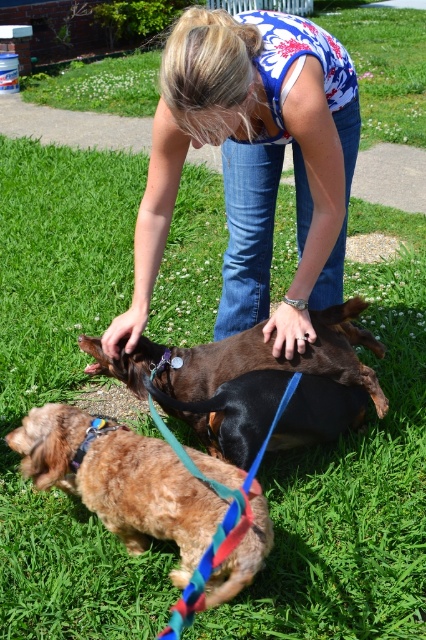
You are a photographer standing 5 feet away from the camera. You want to take a photo of the blue floral tank top at center. Can you reach it without moving closer?

The blue floral tank top at center is 6.04 feet away from the camera. Since you are already 5 feet away from the camera, you need to move 1.04 feet closer to reach it.

Based on the provided scene description, can you identify the object located at the coordinates point (253, 163)?

The point (253, 163) indicates the blue floral tank top at center.

You are a photographer trying to capture the scene of the woman and the dogs. You want to ensure that both the brown glossy dog at center and the shiny brown fur at lower left are visible in your photo. Based on their positions, which dog should you focus on first to frame them properly?

The brown glossy dog at center is located above shiny brown fur at lower left, so you should focus on the brown glossy dog at center first to ensure both are in frame.